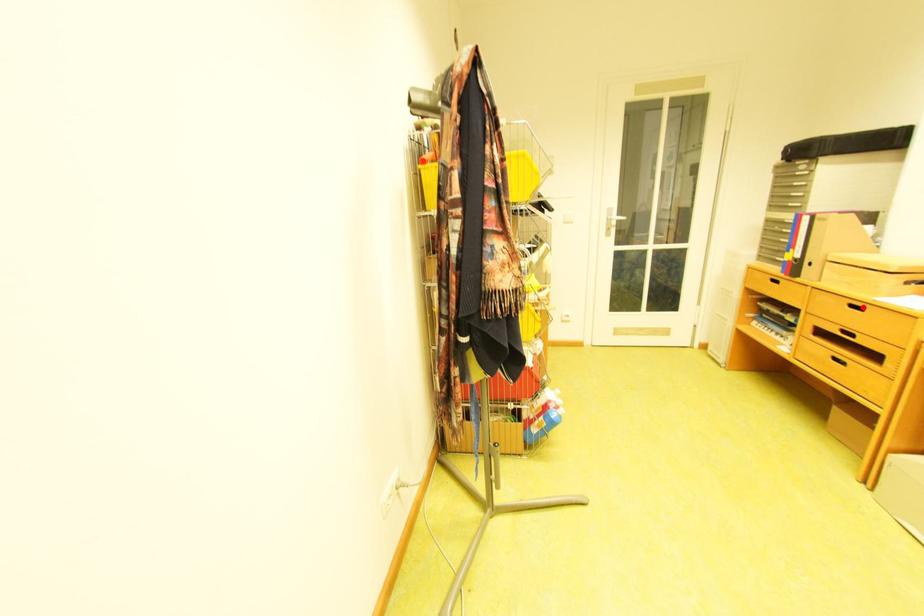
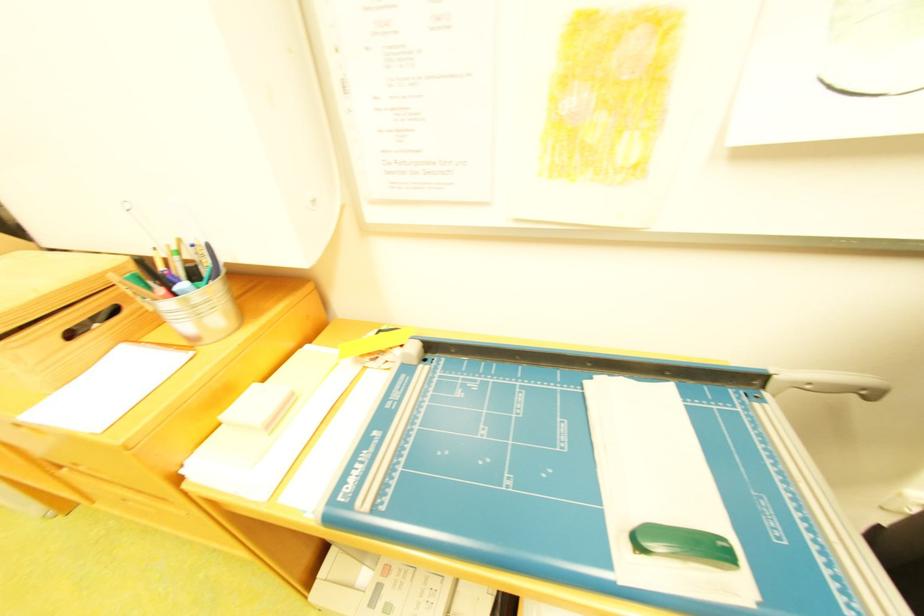
Question: I am providing you with two images of the same scene from different viewpoints. A red point is marked on the first image. At the location where the point appears in image 1, is it still visible in image 2?

Choices:
 (A) Yes
 (B) No

Answer: (B)